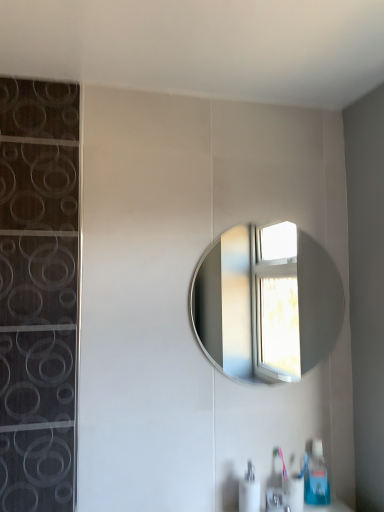
Question: Is blue plastic soap dispenser at lower right, which is the first soap dispenser from back to front, closer to camera compared to satin nickel faucet at lower center?

Choices:
 (A) yes
 (B) no

Answer: (B)

Question: Considering the relative sizes of blue plastic soap dispenser at lower right, the 2th soap dispenser viewed from the left, and satin nickel faucet at lower center in the image provided, is blue plastic soap dispenser at lower right, the 2th soap dispenser viewed from the left, thinner than satin nickel faucet at lower center?

Choices:
 (A) no
 (B) yes

Answer: (B)

Question: Is blue plastic soap dispenser at lower right, the 2th soap dispenser when ordered from front to back, oriented towards satin nickel faucet at lower center?

Choices:
 (A) yes
 (B) no

Answer: (B)

Question: Is satin nickel faucet at lower center completely or partially inside blue plastic soap dispenser at lower right, the 2th soap dispenser viewed from the left?

Choices:
 (A) yes
 (B) no

Answer: (B)

Question: Can we say blue plastic soap dispenser at lower right, the 1th soap dispenser when ordered from right to left, lies outside satin nickel faucet at lower center?

Choices:
 (A) yes
 (B) no

Answer: (A)

Question: From a real-world perspective, does blue plastic soap dispenser at lower right, the 2th soap dispenser when ordered from front to back, sit lower than satin nickel faucet at lower center?

Choices:
 (A) no
 (B) yes

Answer: (A)

Question: Is blue plastic soap dispenser at lower right, which is the first soap dispenser from back to front, not close to white glossy soap dispenser at lower center, which appears as the second soap dispenser when viewed from the right?

Choices:
 (A) yes
 (B) no

Answer: (B)

Question: Is blue plastic soap dispenser at lower right, the 1th soap dispenser when ordered from right to left, thinner than white glossy soap dispenser at lower center, which is the first soap dispenser in left-to-right order?

Choices:
 (A) yes
 (B) no

Answer: (A)

Question: Does blue plastic soap dispenser at lower right, which is the first soap dispenser from back to front, have a lesser height compared to white glossy soap dispenser at lower center, the 2th soap dispenser when ordered from back to front?

Choices:
 (A) no
 (B) yes

Answer: (A)

Question: Is blue plastic soap dispenser at lower right, the 2th soap dispenser viewed from the left, positioned with its back to white glossy soap dispenser at lower center, which is the first soap dispenser in left-to-right order?

Choices:
 (A) no
 (B) yes

Answer: (A)

Question: Can you confirm if blue plastic soap dispenser at lower right, which is the first soap dispenser from back to front, is bigger than white glossy soap dispenser at lower center, which is the first soap dispenser in left-to-right order?

Choices:
 (A) yes
 (B) no

Answer: (B)

Question: From the image's perspective, is blue plastic soap dispenser at lower right, which is the first soap dispenser from back to front, under white glossy soap dispenser at lower center, which is the first soap dispenser in left-to-right order?

Choices:
 (A) yes
 (B) no

Answer: (B)

Question: Is satin nickel faucet at lower center wider than white glossy soap dispenser at lower center, arranged as the 1th soap dispenser when viewed from the front?

Choices:
 (A) yes
 (B) no

Answer: (A)